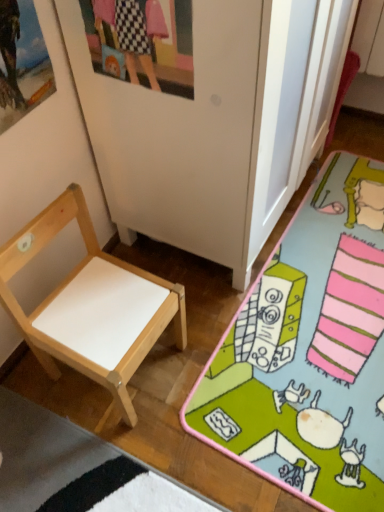
Find the location of a particular element. vacant point to the right of natural wood chair at left is located at coordinates (221, 361).